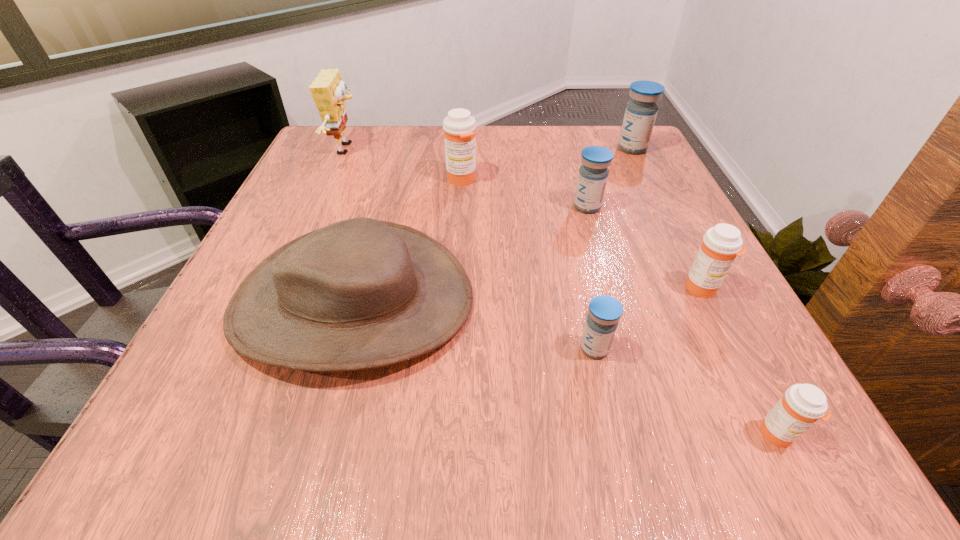
Locate an element on the screen. Image resolution: width=960 pixels, height=540 pixels. free location at the near edge is located at coordinates (316, 438).

Where is `vacant space at the left edge of the desktop`? The image size is (960, 540). vacant space at the left edge of the desktop is located at coordinates (309, 194).

Image resolution: width=960 pixels, height=540 pixels. What are the coordinates of `vacant space at the right edge` in the screenshot? It's located at (750, 380).

Locate an element on the screen. Image resolution: width=960 pixels, height=540 pixels. vacant space at the far left corner of the desktop is located at coordinates (301, 171).

This screenshot has width=960, height=540. In the image, there is a desktop. What are the coordinates of `blank space at the near left corner` in the screenshot? It's located at (141, 436).

You are a GUI agent. You are given a task and a screenshot of the screen. Output one action in this format:
    pyautogui.click(x=<x>, y=<y>)
    Task: Click on the vacant area at the far right corner of the desktop
    
    Given the screenshot: What is the action you would take?
    pyautogui.click(x=605, y=140)

What are the coordinates of `empty location between the yellow sponge and the smallest blue medicine` in the screenshot? It's located at (471, 249).

Image resolution: width=960 pixels, height=540 pixels. What are the coordinates of `unoccupied area between the nearest orange medicine and the second farthest orange medicine` in the screenshot? It's located at (740, 361).

You are a GUI agent. You are given a task and a screenshot of the screen. Output one action in this format:
    pyautogui.click(x=<x>, y=<y>)
    Task: Click on the vacant area that lies between the fifth nearest object and the biggest blue medicine
    The image size is (960, 540).
    Given the screenshot: What is the action you would take?
    pyautogui.click(x=610, y=178)

This screenshot has height=540, width=960. In order to click on vacant area that lies between the nearest medicine and the second farthest orange medicine in this screenshot , I will do `click(740, 361)`.